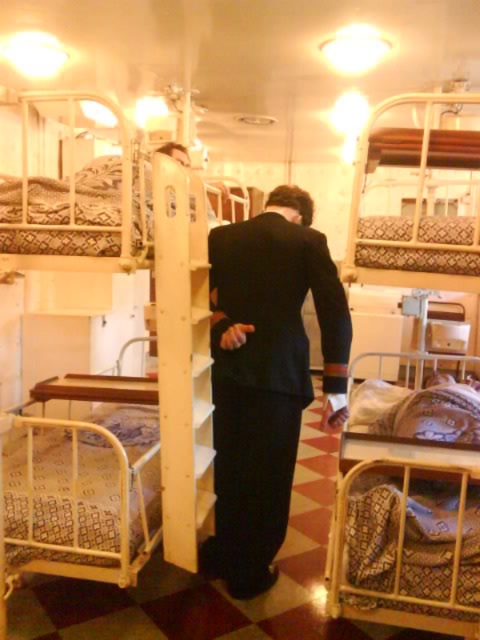
Based on the photo, between black smooth suit at center and patterned fabric bed at lower right, which one appears on the right side from the viewer's perspective?

Positioned to the right is patterned fabric bed at lower right.

The width and height of the screenshot is (480, 640). Find the location of `black smooth suit at center`. black smooth suit at center is located at coordinates (266, 376).

Locate an element on the screen. This screenshot has height=640, width=480. black smooth suit at center is located at coordinates (266, 376).